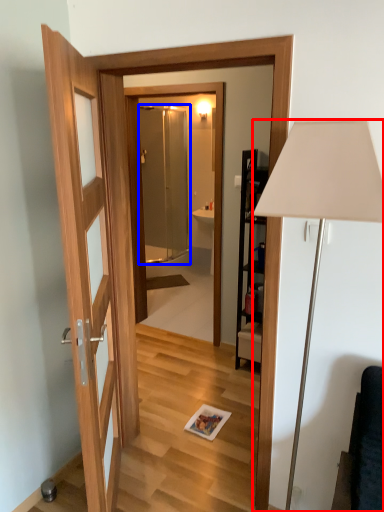
Question: Which of the following is the closest to the observer, lamp (highlighted by a red box) or screen door (highlighted by a blue box)?

Choices:
 (A) lamp
 (B) screen door

Answer: (A)